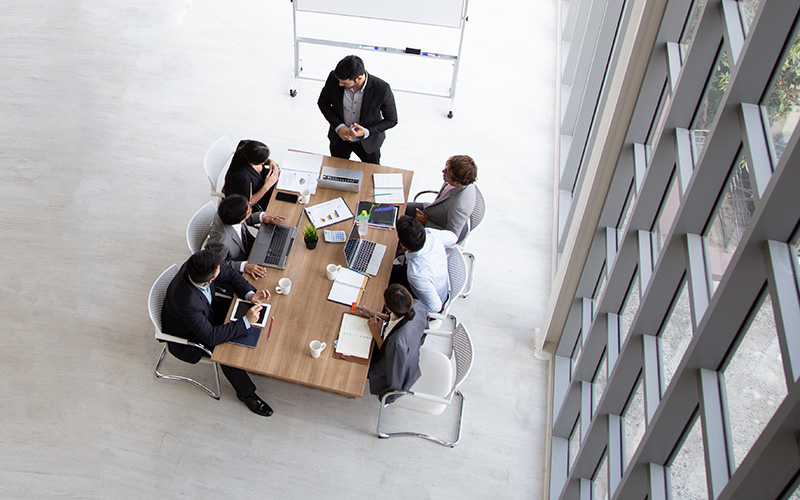
You are a GUI agent. You are given a task and a screenshot of the screen. Output one action in this format:
    pyautogui.click(x=<x>, y=<y>)
    Task: Click on the chairs
    
    Given the screenshot: What is the action you would take?
    pyautogui.click(x=158, y=284), pyautogui.click(x=200, y=223), pyautogui.click(x=221, y=156), pyautogui.click(x=436, y=367), pyautogui.click(x=462, y=271), pyautogui.click(x=476, y=212)